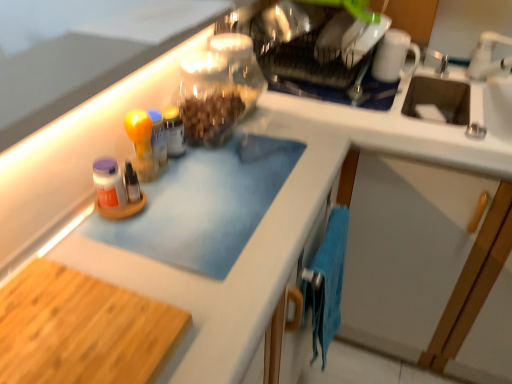
Image resolution: width=512 pixels, height=384 pixels. What are the coordinates of `vacant area that is in front of translucent glass jar at center` in the screenshot? It's located at (181, 199).